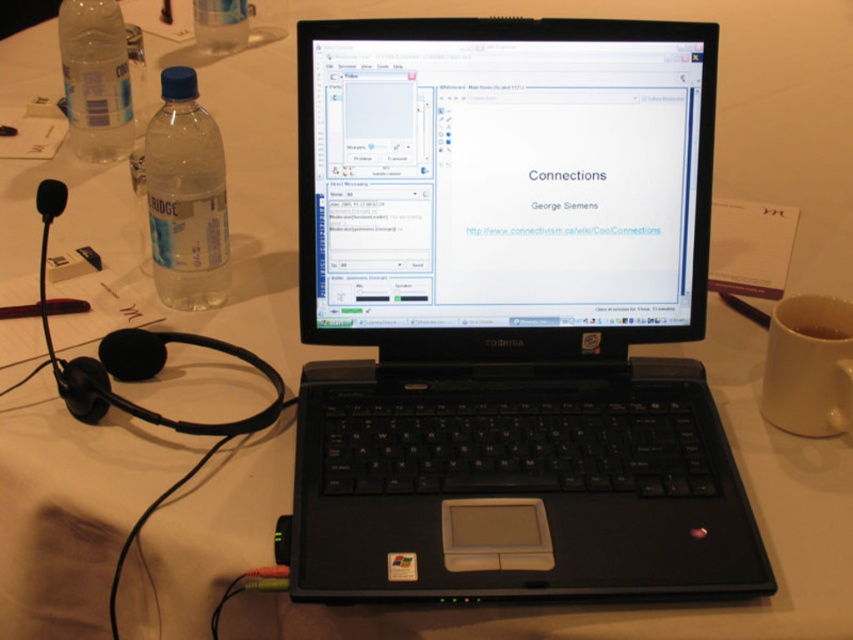
You are organizing a virtual meeting and need to ensure the microphone and headphones are positioned optimally for clear audio. Given the setup described, where is the microphone located relative to the black plastic laptop at center and the clear plastic bottle at left?

The microphone is positioned near the black plastic laptop at center, which is in front of the clear plastic bottle at left.

You are organizing a virtual meeting and need to place a water bottle within easy reach of the laptop. The clear plastic bottle at upper left is your only option. Is the bottle close enough to the black plastic laptop at center for comfortable access during the meeting?

The distance between the black plastic laptop at center and the clear plastic bottle at upper left is 29.60 inches. Since this distance is relatively large, the bottle may not be within comfortable reach during the meeting. Consider moving it closer for easier access.

You are organizing items on a desk and notice two clear plastic bottles. One is labeled as the clear plastic bottle at left and the other as the clear plastic bottle at upper left. Which bottle is located below the other?

The clear plastic bottle at left is positioned under the clear plastic bottle at upper left, meaning the one at left is below the one at upper left.